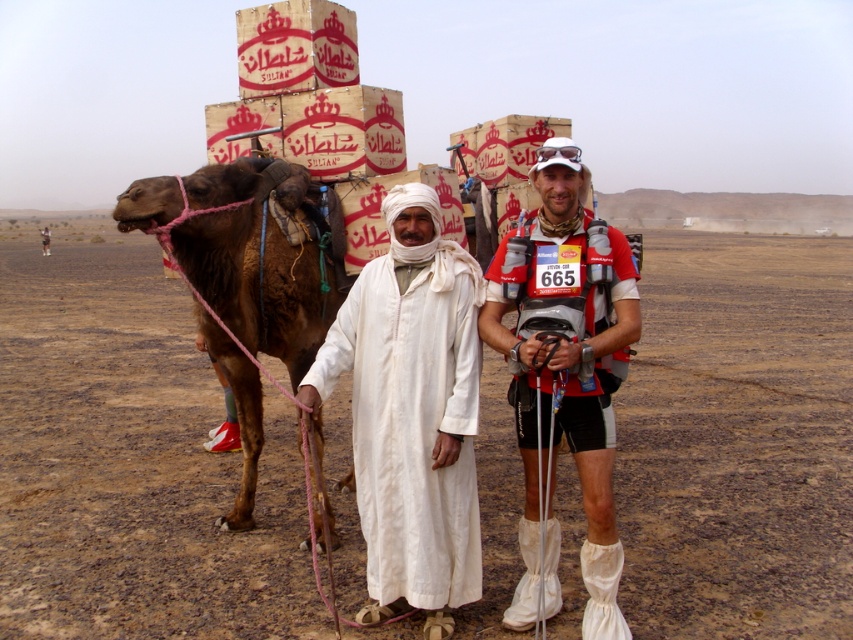
You are a photographer positioned in the desert and need to capture both the matte red shirt at center and the white cotton robe at center in a single frame. Based on their heights, which clothing item will appear taller in your photo?

The matte red shirt at center appears taller in the photo since it has a greater height compared to the white cotton robe at center according to the description.

You are a photographer trying to capture the camel and the two men in the desert scene. You notice a specific point at coordinates (563, 376). What object or part of the scene is located at this point?

The point at (563, 376) is on white cotton clothing at center.